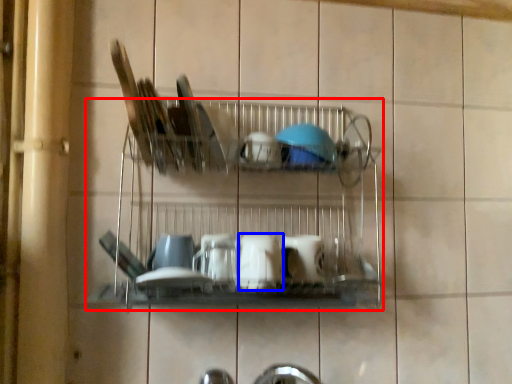
Question: Which object is further to the camera taking this photo, shelf (highlighted by a red box) or tableware (highlighted by a blue box)?

Choices:
 (A) shelf
 (B) tableware

Answer: (B)